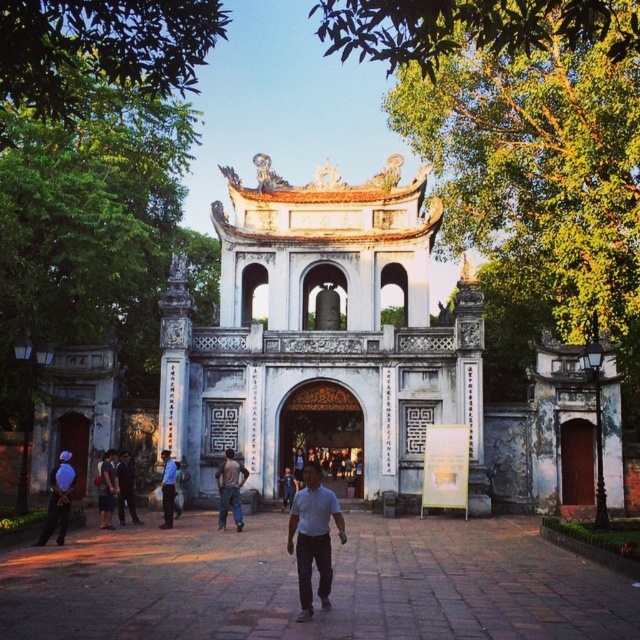
You are a tourist visiting this historical site and want to take a photo of the brown wooden gate at center and the dark blue shirt at center. Since you want both objects to appear clearly in the photo, which one should you focus on first to ensure proper focus?

The brown wooden gate at center is larger in size than the dark blue shirt at center, so you should focus on the brown wooden gate at center first to ensure proper focus.

You are standing in front of a traditional East Asian temple with a symmetrical design and curved eaves. There is a point at coordinates point (332, 385). Considering the temple structure, can you determine if this point is closer to the viewer or further away than the central archway?

The point at point (332, 385) is 76.00 meters away from the viewer, so it is further away than the central archway.